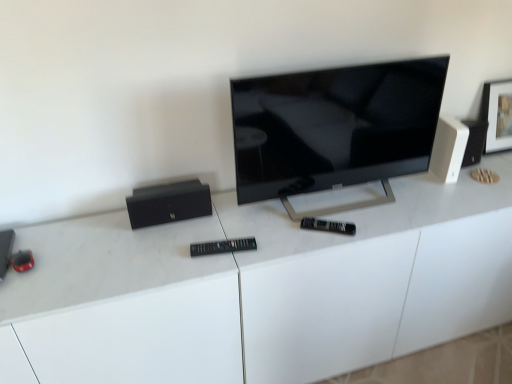
Where is `vacant space that's between metallic black speaker at left, which is the third speaker in right-to-left order, and black glossy tv at center`? vacant space that's between metallic black speaker at left, which is the third speaker in right-to-left order, and black glossy tv at center is located at coordinates (141, 240).